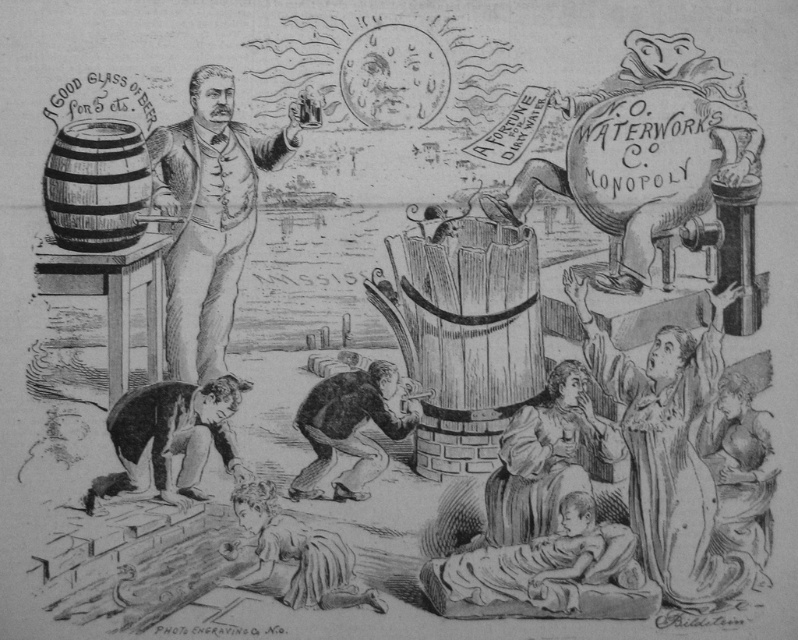
Between etched wood portrait at center and dark skin child at lower center, which one appears on the right side from the viewer's perspective?

Positioned to the right is dark skin child at lower center.

Who is more distant from viewer, (230, 284) or (449, 611)?

The point (230, 284) is behind.

Where is `etched wood portrait at center`? etched wood portrait at center is located at coordinates (208, 216).

Can you confirm if dark skin child at lower center is bigger than smooth skin person at lower left?

Yes.

Who is positioned more to the left, dark skin child at lower center or smooth skin person at lower left?

smooth skin person at lower left

Find the location of a particular element. The width and height of the screenshot is (798, 640). dark skin child at lower center is located at coordinates (544, 572).

Is point (144, 440) positioned before point (346, 413)?

That is False.

Between smooth skin person at lower left and dark brown leather boot at lower center, which one appears on the right side from the viewer's perspective?

dark brown leather boot at lower center

What are the coordinates of `smooth skin person at lower left` in the screenshot? It's located at (168, 436).